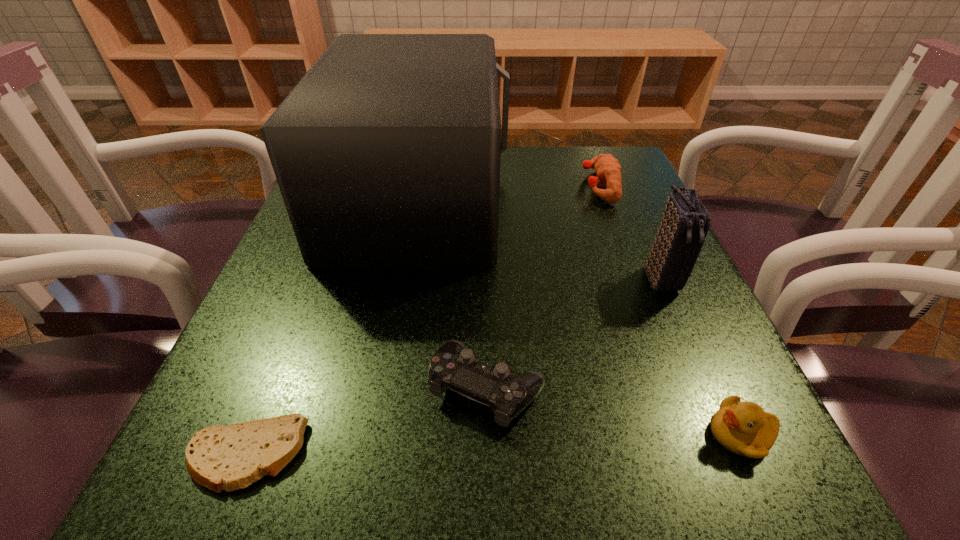
Where is `free region located 0.380m with the gloves of the puncher facing forward`? free region located 0.380m with the gloves of the puncher facing forward is located at coordinates (413, 186).

The height and width of the screenshot is (540, 960). In order to click on vacant region located 0.270m on the left of the control in this screenshot , I will do `click(235, 388)`.

What are the coordinates of `free space located 0.270m at the beak of the duckling` in the screenshot? It's located at (496, 434).

Identify the location of vacant space located 0.280m at the beak of the duckling. The width and height of the screenshot is (960, 540). [x=489, y=434].

What are the coordinates of `vacant region located at the beak of the duckling` in the screenshot? It's located at (536, 434).

Identify the location of free space located on the back of the shortest object. (313, 286).

At what (x,y) coordinates should I click in order to perform the action: click on microwave oven present at the far edge. Please return your answer as a coordinate pair (x, y). Image resolution: width=960 pixels, height=540 pixels. Looking at the image, I should click on (387, 152).

Locate an element on the screen. The height and width of the screenshot is (540, 960). puncher that is at the far edge is located at coordinates (608, 169).

You are a GUI agent. You are given a task and a screenshot of the screen. Output one action in this format:
    pyautogui.click(x=<x>, y=<y>)
    Task: Click on the duckling located at the near edge
    The width and height of the screenshot is (960, 540).
    Given the screenshot: What is the action you would take?
    pyautogui.click(x=743, y=428)

This screenshot has width=960, height=540. I want to click on pita bread that is positioned at the near edge, so click(x=218, y=457).